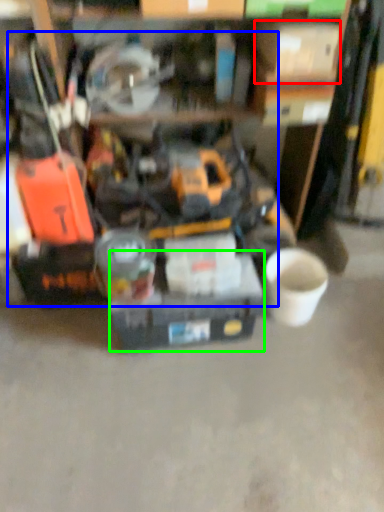
Question: Which is farther away from box (highlighted by a red box)? tool (highlighted by a blue box) or box (highlighted by a green box)?

Choices:
 (A) tool
 (B) box

Answer: (B)